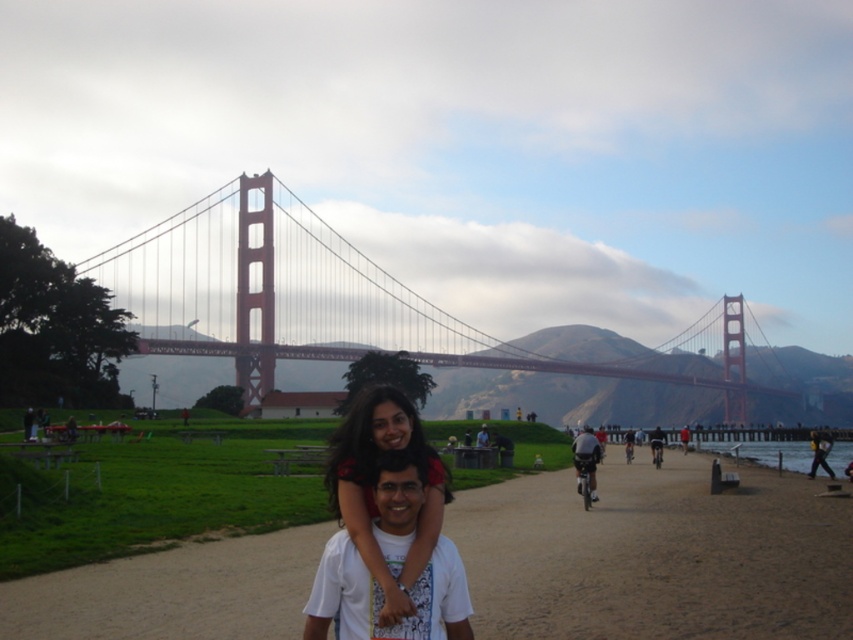
Can you confirm if painted steel golden gate bridge at center is positioned to the right of dark gray helmet at center?

Yes, painted steel golden gate bridge at center is to the right of dark gray helmet at center.

Looking at this image, how much distance is there between painted steel golden gate bridge at center and dark gray helmet at center?

A distance of 694.78 feet exists between painted steel golden gate bridge at center and dark gray helmet at center.

Which is behind, point (224, 257) or point (590, 468)?

Positioned behind is point (224, 257).

At what (x,y) coordinates should I click in order to perform the action: click on painted steel golden gate bridge at center. Please return your answer as a coordinate pair (x, y). The image size is (853, 640). Looking at the image, I should click on (335, 301).

Can you confirm if matte black hair at center is positioned to the right of dark brown leather jacket at center?

In fact, matte black hair at center is to the left of dark brown leather jacket at center.

Find the location of a particular element. The width and height of the screenshot is (853, 640). matte black hair at center is located at coordinates (370, 488).

Where is `matte black hair at center`? The height and width of the screenshot is (640, 853). matte black hair at center is located at coordinates (370, 488).

Is point (560, 552) farther from camera compared to point (404, 600)?

Yes, it is behind point (404, 600).

Does smooth sand path at center appear over matte black hair at center?

No, smooth sand path at center is not above matte black hair at center.

The width and height of the screenshot is (853, 640). What do you see at coordinates (654, 554) in the screenshot? I see `smooth sand path at center` at bounding box center [654, 554].

Where is `smooth sand path at center`? The width and height of the screenshot is (853, 640). smooth sand path at center is located at coordinates tap(654, 554).